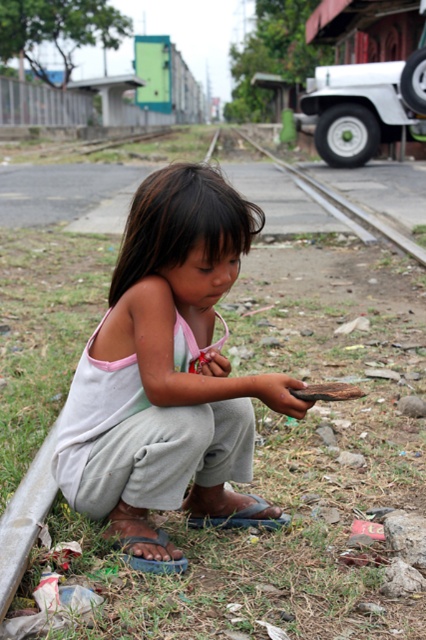
Which is behind, point (155, 337) or point (348, 202)?

Positioned behind is point (348, 202).

Is point (138, 211) in front of point (382, 234)?

Yes, it is.

Image resolution: width=426 pixels, height=640 pixels. Describe the element at coordinates (167, 374) in the screenshot. I see `light gray cotton pants at center` at that location.

At what (x,y) coordinates should I click in order to perform the action: click on light gray cotton pants at center. Please return your answer as a coordinate pair (x, y). This screenshot has height=640, width=426. Looking at the image, I should click on (167, 374).